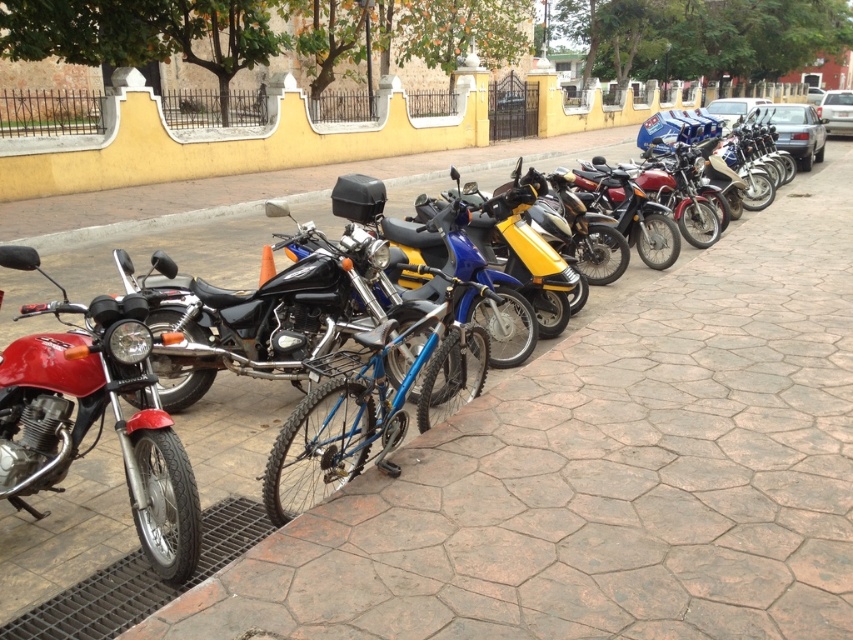
Question: Does shiny red motorcycle at left appear over blue metallic bicycle at center?

Choices:
 (A) yes
 (B) no

Answer: (B)

Question: Is shiny red motorcycle at left smaller than blue metallic bicycle at center?

Choices:
 (A) no
 (B) yes

Answer: (B)

Question: Is shiny red motorcycle at left behind blue metallic bicycle at center?

Choices:
 (A) no
 (B) yes

Answer: (A)

Question: Which of the following is the closest to the observer?

Choices:
 (A) (283, 480)
 (B) (41, 355)

Answer: (B)

Question: Which of the following is the farthest from the observer?

Choices:
 (A) shiny red motorcycle at left
 (B) blue metallic bicycle at center

Answer: (B)